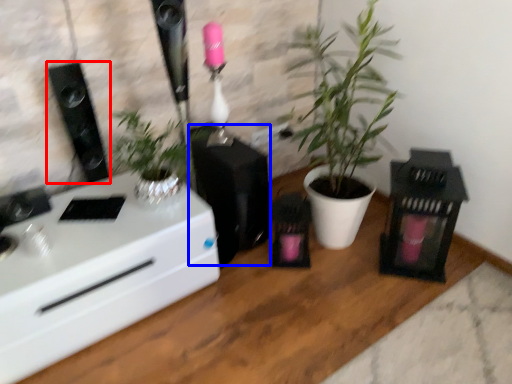
Question: Which object is further to the camera taking this photo, loudspeaker (highlighted by a red box) or appliance (highlighted by a blue box)?

Choices:
 (A) loudspeaker
 (B) appliance

Answer: (B)